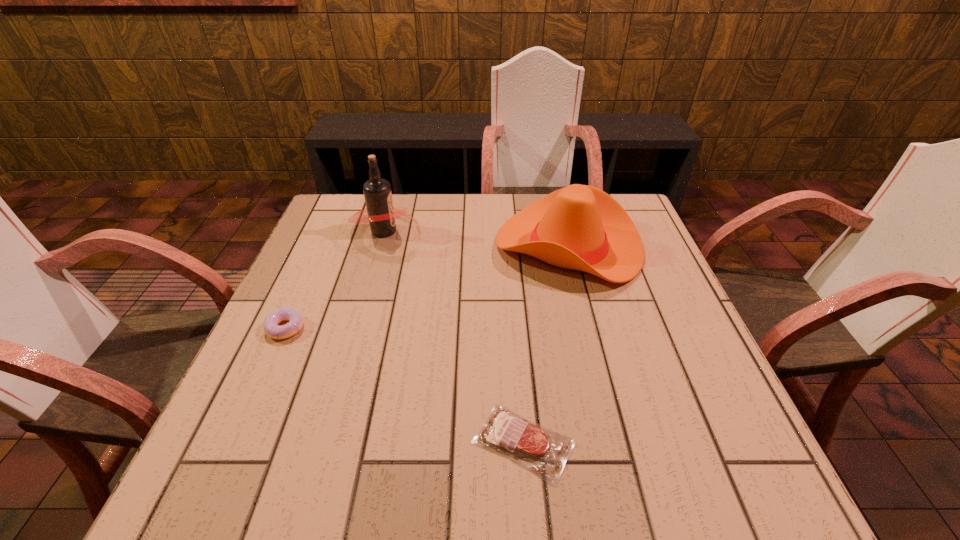
Find the location of a particular element. Image resolution: width=960 pixels, height=540 pixels. free space located on the left of the shortest object is located at coordinates (437, 442).

Locate an element on the screen. The height and width of the screenshot is (540, 960). root beer at the far edge is located at coordinates (381, 216).

What are the coordinates of `cowboy hat that is at the far edge` in the screenshot? It's located at (579, 227).

The height and width of the screenshot is (540, 960). I want to click on object that is at the near edge, so click(532, 446).

This screenshot has width=960, height=540. Find the location of `root beer situated at the left edge`. root beer situated at the left edge is located at coordinates (381, 216).

At what (x,y) coordinates should I click in order to perform the action: click on doughnut at the left edge. Please return your answer as a coordinate pair (x, y). The width and height of the screenshot is (960, 540). Looking at the image, I should click on (270, 325).

The height and width of the screenshot is (540, 960). In order to click on object at the right edge in this screenshot , I will do `click(579, 227)`.

This screenshot has width=960, height=540. What are the coordinates of `object present at the far left corner` in the screenshot? It's located at (381, 216).

This screenshot has width=960, height=540. I want to click on object located in the far right corner section of the desktop, so click(579, 227).

Where is `vacant space at the far edge of the desktop`? The image size is (960, 540). vacant space at the far edge of the desktop is located at coordinates (418, 240).